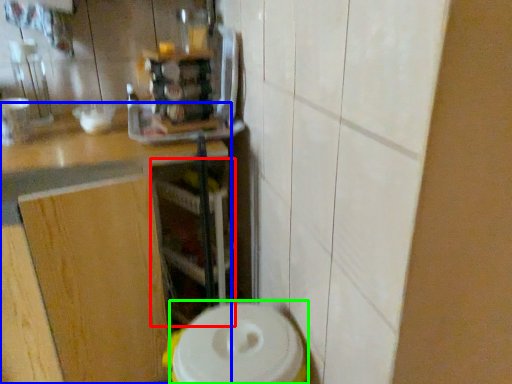
Question: Considering the real-world distances, which object is farthest from shelf (highlighted by a red box)? countertop (highlighted by a blue box) or appliance (highlighted by a green box)?

Choices:
 (A) countertop
 (B) appliance

Answer: (B)